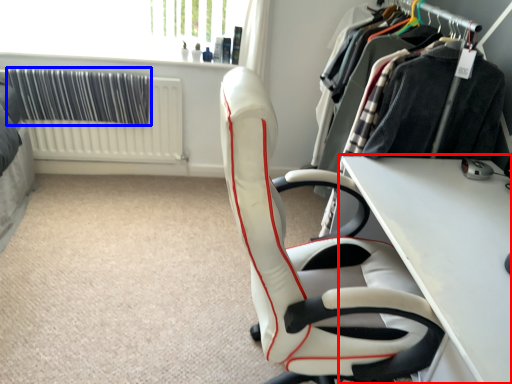
Question: Which of the following is the farthest to the observer, table (highlighted by a red box) or curtain (highlighted by a blue box)?

Choices:
 (A) table
 (B) curtain

Answer: (B)